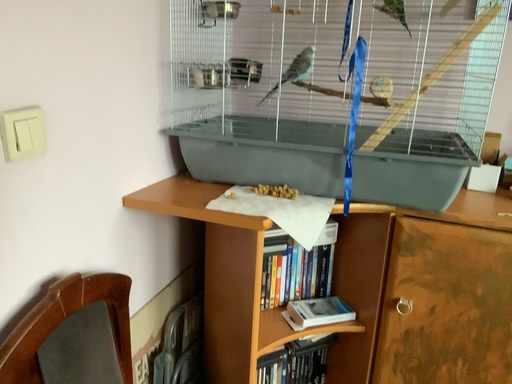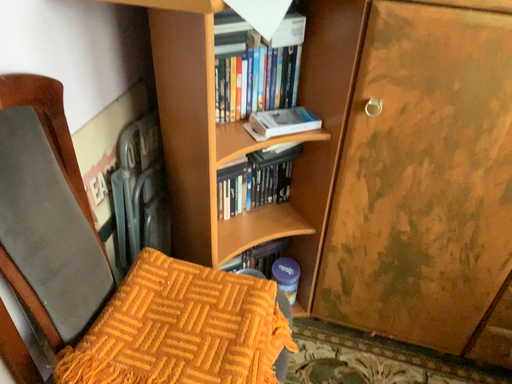
Question: Which way did the camera rotate in the video?

Choices:
 (A) rotated downward
 (B) rotated upward

Answer: (A)